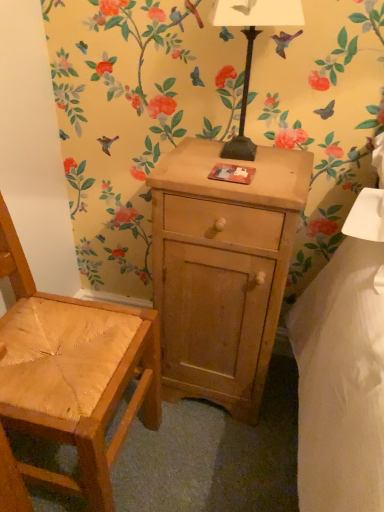
Question: Can you see metallic black lamp at upper center touching natural wood chair at left?

Choices:
 (A) no
 (B) yes

Answer: (A)

Question: Is metallic black lamp at upper center at the right side of natural wood chair at left?

Choices:
 (A) no
 (B) yes

Answer: (B)

Question: Is metallic black lamp at upper center looking in the opposite direction of natural wood chair at left?

Choices:
 (A) no
 (B) yes

Answer: (A)

Question: Considering the relative positions of metallic black lamp at upper center and natural wood chair at left in the image provided, is metallic black lamp at upper center to the left of natural wood chair at left from the viewer's perspective?

Choices:
 (A) yes
 (B) no

Answer: (B)

Question: Would you consider metallic black lamp at upper center to be distant from natural wood chair at left?

Choices:
 (A) yes
 (B) no

Answer: (B)

Question: Does metallic black lamp at upper center have a lesser width compared to natural wood chair at left?

Choices:
 (A) yes
 (B) no

Answer: (A)

Question: Is light brown wood cabinet at center facing away from metallic black lamp at upper center?

Choices:
 (A) yes
 (B) no

Answer: (B)

Question: Is light brown wood cabinet at center behind metallic black lamp at upper center?

Choices:
 (A) yes
 (B) no

Answer: (A)

Question: Is light brown wood cabinet at center beside metallic black lamp at upper center?

Choices:
 (A) no
 (B) yes

Answer: (A)

Question: Can you confirm if light brown wood cabinet at center is positioned to the left of metallic black lamp at upper center?

Choices:
 (A) yes
 (B) no

Answer: (A)

Question: Is light brown wood cabinet at center far from metallic black lamp at upper center?

Choices:
 (A) no
 (B) yes

Answer: (A)

Question: Is light brown wood cabinet at center outside metallic black lamp at upper center?

Choices:
 (A) no
 (B) yes

Answer: (B)

Question: Is natural wood chair at left positioned in front of light brown wood cabinet at center?

Choices:
 (A) no
 (B) yes

Answer: (B)